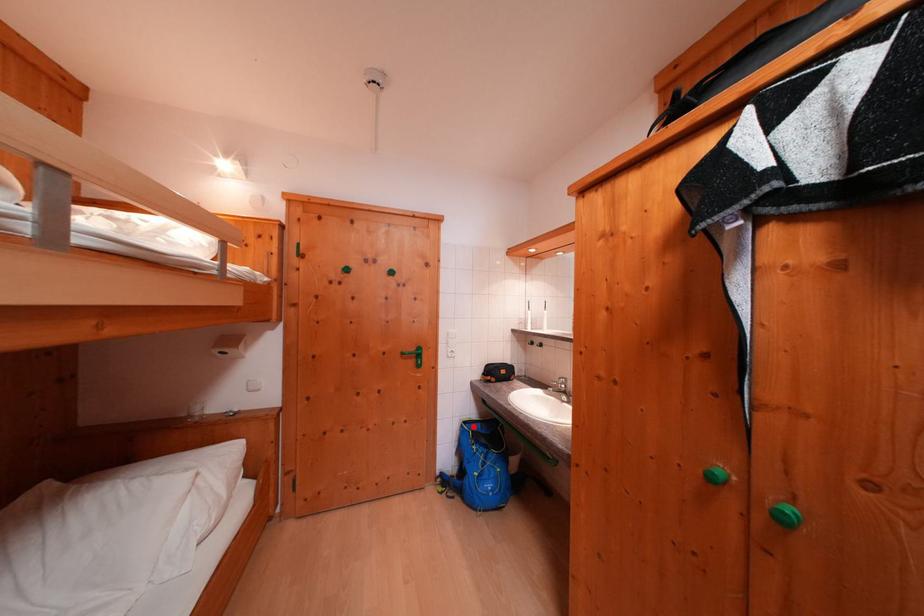
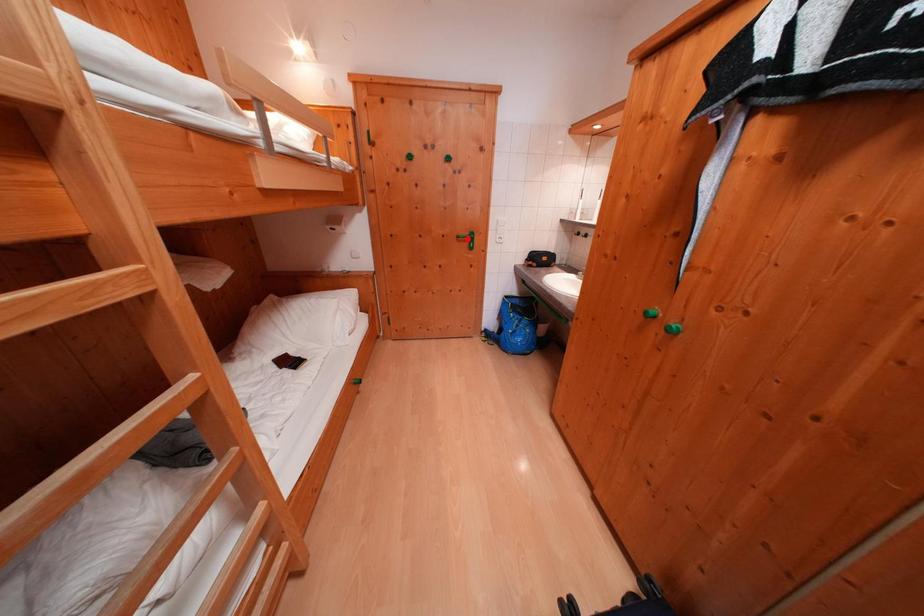
I am providing you with two images of the same scene from different viewpoints. A red point is marked on the first image and another point is marked on the second image. Is the marked point in image1 the same physical position as the marked point in image2?

No